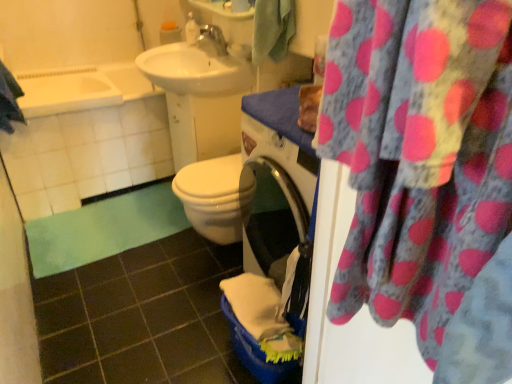
Question: From the image's perspective, does silver metallic faucet at upper center appear lower than pink polka dot fabric at upper right?

Choices:
 (A) no
 (B) yes

Answer: (A)

Question: Is silver metallic faucet at upper center looking in the opposite direction of pink polka dot fabric at upper right?

Choices:
 (A) yes
 (B) no

Answer: (B)

Question: Is silver metallic faucet at upper center not near pink polka dot fabric at upper right?

Choices:
 (A) yes
 (B) no

Answer: (A)

Question: Can you confirm if silver metallic faucet at upper center is smaller than pink polka dot fabric at upper right?

Choices:
 (A) yes
 (B) no

Answer: (A)

Question: Could you tell me if silver metallic faucet at upper center is facing pink polka dot fabric at upper right?

Choices:
 (A) yes
 (B) no

Answer: (B)

Question: Is white glossy soap dispenser at upper center in front of or behind pink polka dot fabric at upper right in the image?

Choices:
 (A) front
 (B) behind

Answer: (B)

Question: Considering the positions of point (196, 29) and point (464, 218), is point (196, 29) closer or farther from the camera than point (464, 218)?

Choices:
 (A) closer
 (B) farther

Answer: (B)

Question: Considering the positions of white glossy soap dispenser at upper center and pink polka dot fabric at upper right in the image, is white glossy soap dispenser at upper center taller or shorter than pink polka dot fabric at upper right?

Choices:
 (A) tall
 (B) short

Answer: (B)

Question: Looking at their shapes, would you say white glossy soap dispenser at upper center is wider or thinner than pink polka dot fabric at upper right?

Choices:
 (A) wide
 (B) thin

Answer: (A)

Question: Considering the positions of point (32, 107) and point (206, 41), is point (32, 107) closer or farther from the camera than point (206, 41)?

Choices:
 (A) closer
 (B) farther

Answer: (A)

Question: Is white glossy bathtub at upper left wider or thinner than silver metallic faucet at upper center?

Choices:
 (A) wide
 (B) thin

Answer: (A)

Question: From the image's perspective, is white glossy bathtub at upper left positioned above or below silver metallic faucet at upper center?

Choices:
 (A) above
 (B) below

Answer: (B)

Question: From a real-world perspective, relative to silver metallic faucet at upper center, is white glossy bathtub at upper left vertically above or below?

Choices:
 (A) below
 (B) above

Answer: (A)

Question: From a real-world perspective, is blue textured towel at upper left, the 1th beach towel viewed from the left, positioned above or below white glossy soap dispenser at upper center?

Choices:
 (A) below
 (B) above

Answer: (A)

Question: In terms of height, does blue textured towel at upper left, positioned as the second beach towel in right-to-left order, look taller or shorter compared to white glossy soap dispenser at upper center?

Choices:
 (A) short
 (B) tall

Answer: (B)